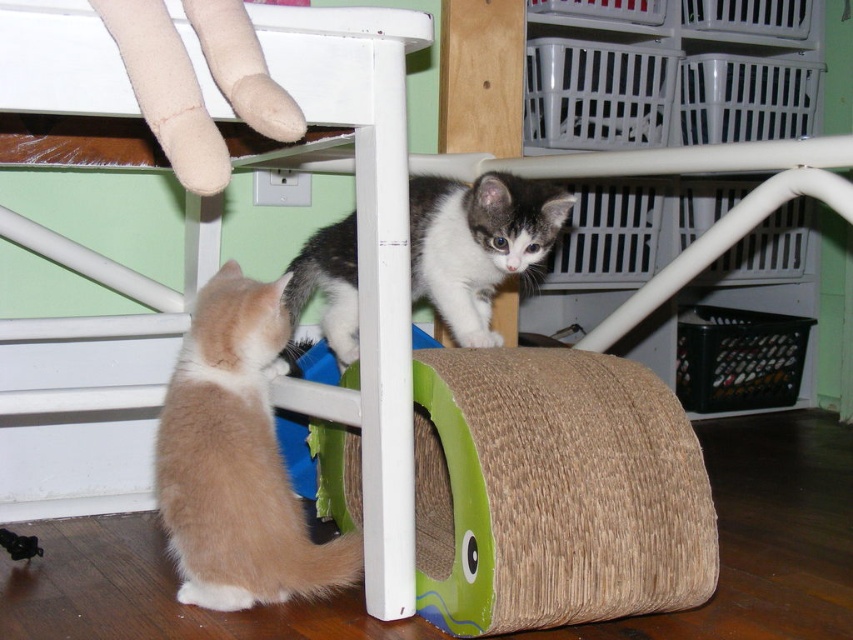
The image size is (853, 640). What do you see at coordinates (236, 460) in the screenshot?
I see `light brown fur at lower left` at bounding box center [236, 460].

Which is below, light brown fur at lower left or gray-white fur cat at under table?

light brown fur at lower left is lower down.

Is point (267, 406) in front of point (426, 198)?

Yes, it is in front of point (426, 198).

This screenshot has height=640, width=853. What are the coordinates of `light brown fur at lower left` in the screenshot? It's located at (236, 460).